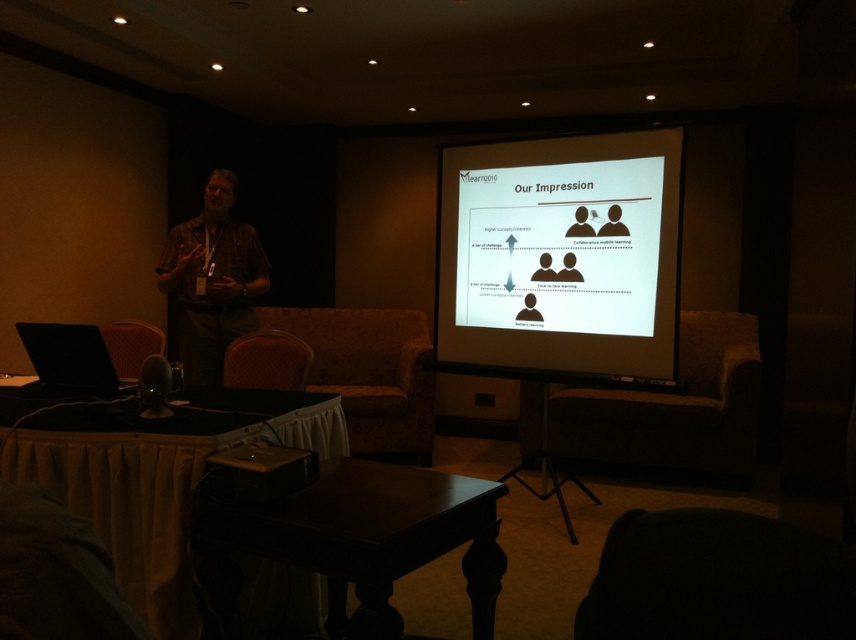
You are standing in the conference room and want to approach the matte plaid shirt at left and the velvet red armchair at lower left. Which object will you encounter first as you move forward?

You will encounter the matte plaid shirt at left first because it is closer to you than the velvet red armchair at lower left, which is further away.

You are standing in the conference room and want to walk towards the two points marked in the image. Which point will you reach first, point (492, 189) or point (293, 451)?

Point (492, 189) is further to the camera than point (293, 451), so you will reach point (293, 451) first because it is closer to you.

You are setting up for a presentation in the conference room. You need to adjust the angle of the white glossy projector screen at upper center so that it faces the black plastic projector at lower center. Is the screen currently positioned above or below the projector?

The white glossy projector screen at upper center is positioned above the black plastic projector at lower center.